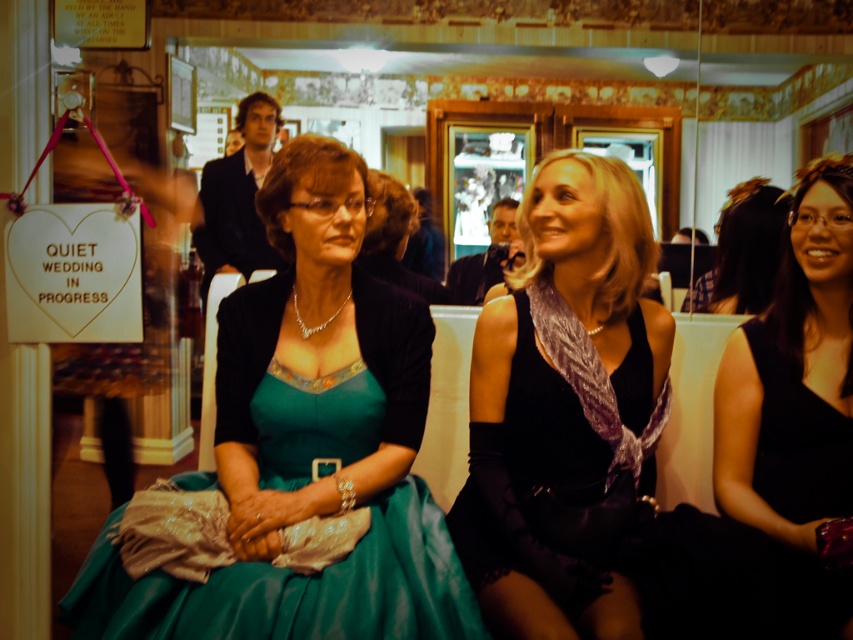
Question: Estimate the real-world distances between objects in this image. Which object is closer to the black satin dress at right?

Choices:
 (A) teal satin dress at center
 (B) satin black dress at center

Answer: (B)

Question: Is the position of teal satin dress at center more distant than that of satin black dress at center?

Choices:
 (A) no
 (B) yes

Answer: (A)

Question: Is teal satin dress at center closer to the viewer compared to black satin dress at right?

Choices:
 (A) yes
 (B) no

Answer: (A)

Question: Can you confirm if satin black dress at center is thinner than black satin dress at right?

Choices:
 (A) no
 (B) yes

Answer: (A)

Question: Estimate the real-world distances between objects in this image. Which object is farther from the satin black dress at center?

Choices:
 (A) teal satin dress at center
 (B) black satin dress at right

Answer: (B)

Question: Which point is closer to the camera taking this photo?

Choices:
 (A) (641, 630)
 (B) (363, 632)
 (C) (805, 419)

Answer: (B)